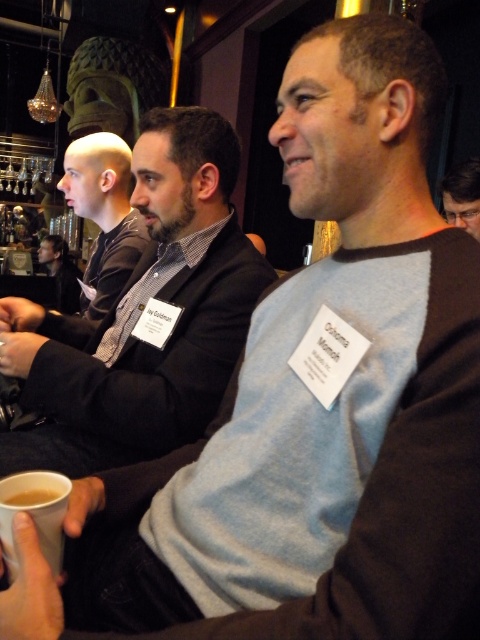
Based on the photo, you are at a bar and want to order a drink. You see a light blue sweater at center and a brown matte cup at lower left. Which object is closer to the right side of the image?

The brown matte cup at lower left is closer to the right side because the light blue sweater at center is to its left.

You are a guest at this event and want to pick up your drink from the table. There are two cups here, the brown paper cup at lower left and the brown matte cup at lower left. Which one is easier to reach without moving your current position?

The brown paper cup at lower left is easier to reach because it is closer to you than the brown matte cup at lower left.